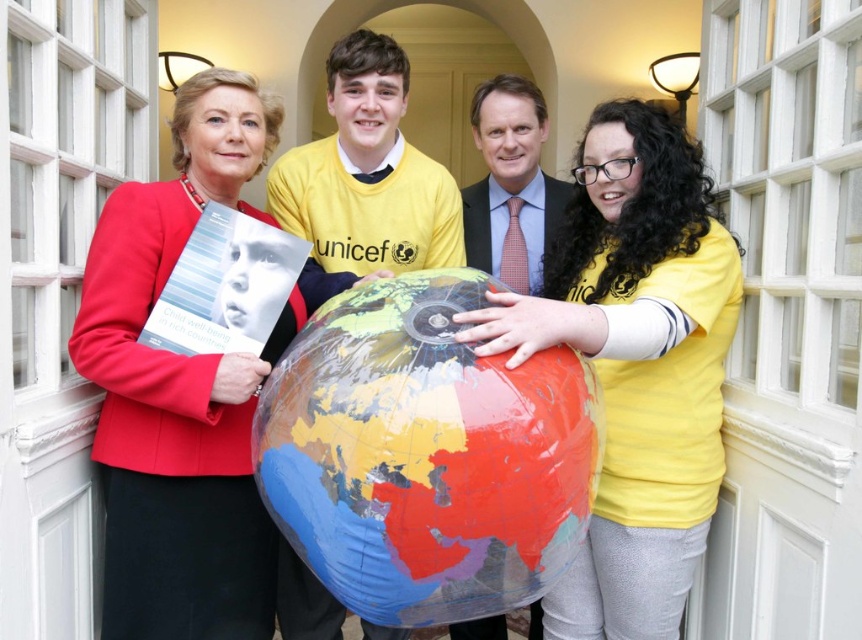
Question: Considering the relative positions of matte yellow shirt at right and smooth suit at center in the image provided, where is matte yellow shirt at right located with respect to smooth suit at center?

Choices:
 (A) right
 (B) left

Answer: (A)

Question: Which of the following is the closest to the observer?

Choices:
 (A) (582, 531)
 (B) (506, 244)
 (C) (142, 612)

Answer: (A)

Question: Can you confirm if matte red blazer at left is thinner than matte black suit at center?

Choices:
 (A) yes
 (B) no

Answer: (B)

Question: Which of the following is the farthest from the observer?

Choices:
 (A) (338, 280)
 (B) (547, 202)
 (C) (405, 353)

Answer: (B)

Question: Is translucent plastic globe at center smaller than matte yellow shirt at right?

Choices:
 (A) yes
 (B) no

Answer: (A)

Question: Which point is farther to the camera?

Choices:
 (A) translucent plastic globe at center
 (B) smooth suit at center
 (C) matte yellow shirt at right
 (D) yellow fabric shirt at center

Answer: (B)